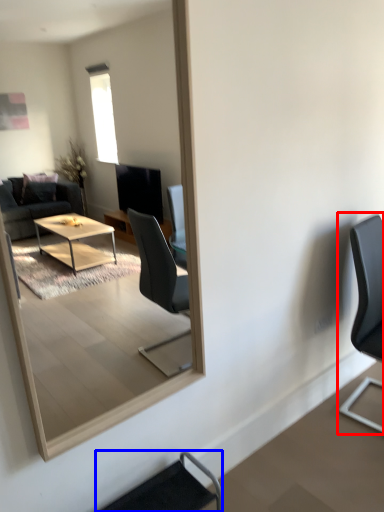
Question: Which of the following is the closest to the observer, chair (highlighted by a red box) or chair (highlighted by a blue box)?

Choices:
 (A) chair
 (B) chair

Answer: (B)